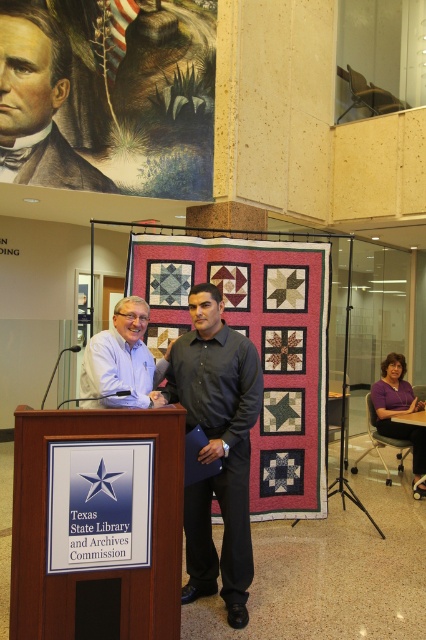
Does colored paper portrait at upper left have a greater height compared to wooden podium at center?

Yes.

Is colored paper portrait at upper left closer to the viewer compared to wooden podium at center?

No, colored paper portrait at upper left is further to the viewer.

Is point (150, 138) farther from camera compared to point (68, 582)?

That is True.

Where is `colored paper portrait at upper left`? The width and height of the screenshot is (426, 640). colored paper portrait at upper left is located at coordinates (109, 93).

Does black smooth shirt at center have a lesser height compared to purple fabric at lower right?

No, black smooth shirt at center is not shorter than purple fabric at lower right.

Is point (210, 419) behind point (389, 356)?

No, (210, 419) is in front of (389, 356).

The image size is (426, 640). Describe the element at coordinates (218, 445) in the screenshot. I see `black smooth shirt at center` at that location.

The height and width of the screenshot is (640, 426). What are the coordinates of `black smooth shirt at center` in the screenshot? It's located at (218, 445).

Is the position of wooden podium at center more distant than that of black smooth shirt at center?

No, wooden podium at center is in front of black smooth shirt at center.

Can you confirm if wooden podium at center is smaller than black smooth shirt at center?

Correct, wooden podium at center occupies less space than black smooth shirt at center.

Does point (83, 522) come in front of point (203, 460)?

That is True.

Identify the location of wooden podium at center. This screenshot has height=640, width=426. (100, 525).